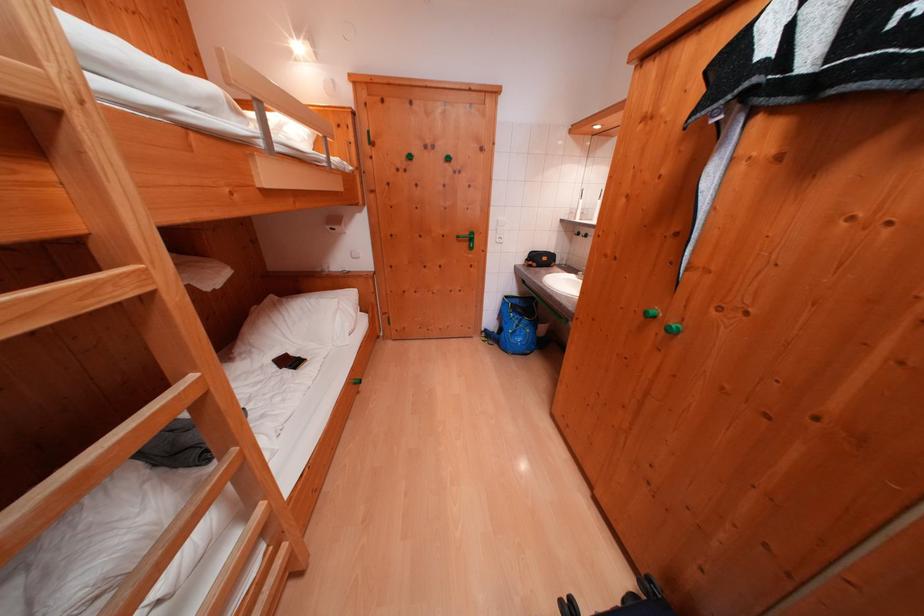
Which object does [516,326] point to?

This point indicates the blue backpack.